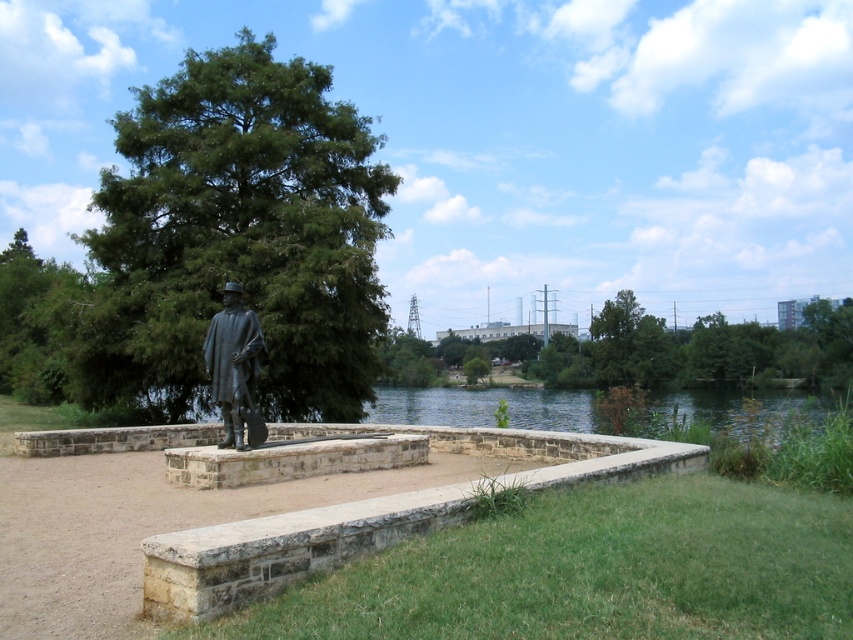
Question: Where is green matte tree at center located in relation to green leafy tree at upper center in the image?

Choices:
 (A) below
 (B) above

Answer: (B)

Question: Can you confirm if stone ledge at center is wider than green leafy tree at upper center?

Choices:
 (A) no
 (B) yes

Answer: (A)

Question: Considering the real-world distances, which object is farthest from the bronze statue at center?

Choices:
 (A) stone ledge at center
 (B) green matte tree at center

Answer: (B)

Question: Which is farther from the stone ledge at center?

Choices:
 (A) green matte tree at center
 (B) bronze statue at center

Answer: (A)

Question: Is stone ledge at center positioned before bronze statue at center?

Choices:
 (A) yes
 (B) no

Answer: (A)

Question: Which of these objects is positioned farthest from the green leafy tree at upper center?

Choices:
 (A) stone ledge at center
 (B) green matte tree at center

Answer: (A)